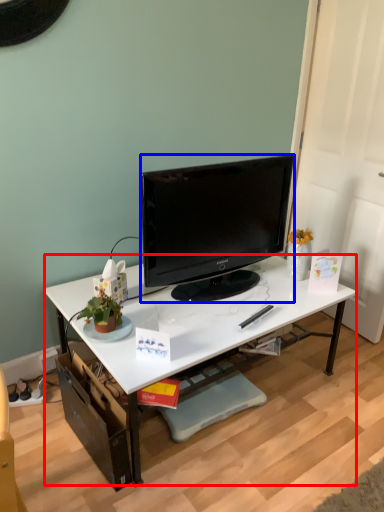
Question: Which point is further to the camera, desk (highlighted by a red box) or television (highlighted by a blue box)?

Choices:
 (A) desk
 (B) television

Answer: (B)